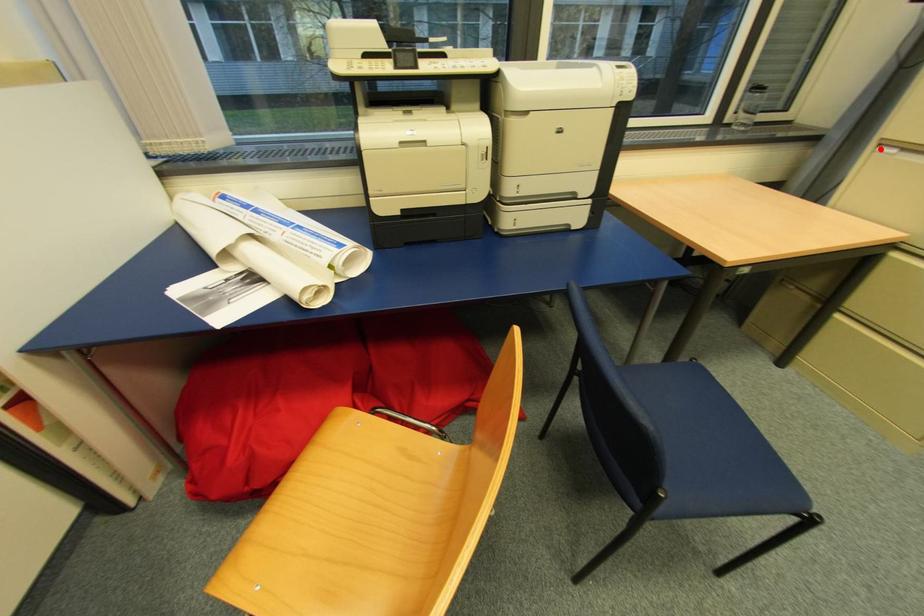
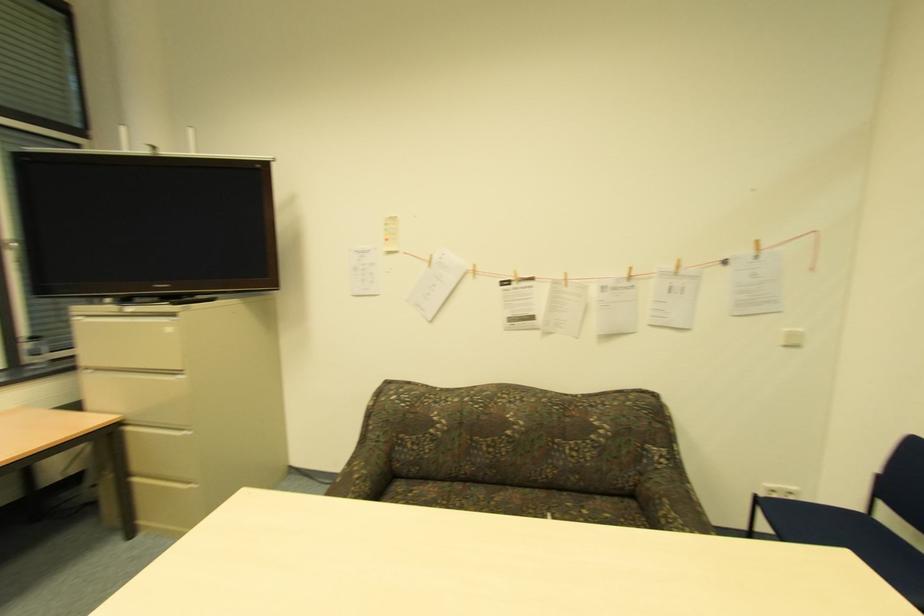
Question: I am providing you with two images of the same scene from different viewpoints. In image1, a red point is highlighted. Considering the same 3D point in image2, which of the following is correct?

Choices:
 (A) It is closer
 (B) It is farther

Answer: (A)